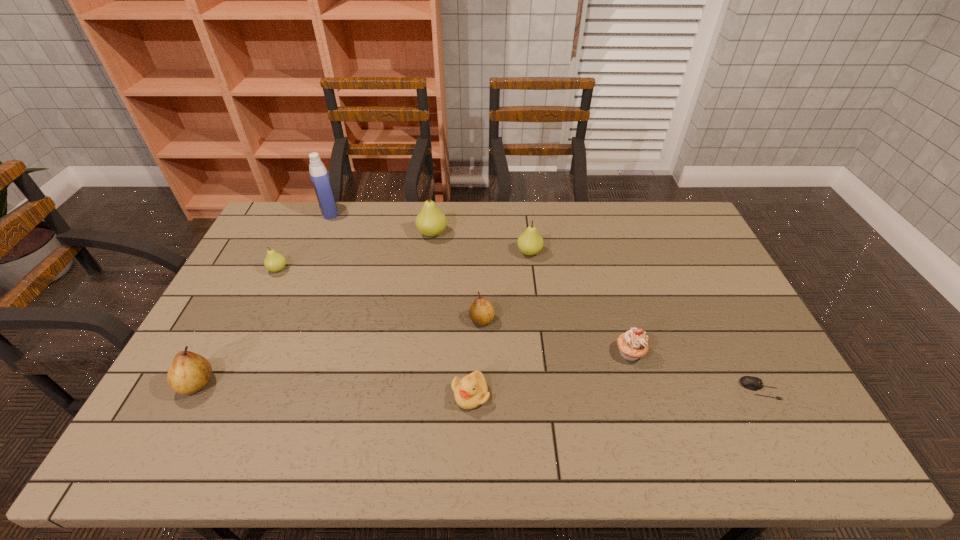
In order to click on free location that satisfies the following two spatial constraints: 1. on the front side of the fourth object from left to right; 2. on the right side of the blue detergent in this screenshot , I will do `click(320, 233)`.

At what (x,y) coordinates should I click in order to perform the action: click on vacant space that satisfies the following two spatial constraints: 1. on the back side of the third nearest pear; 2. on the left side of the left brown pear. Please return your answer as a coordinate pair (x, y). The width and height of the screenshot is (960, 540). Looking at the image, I should click on (258, 269).